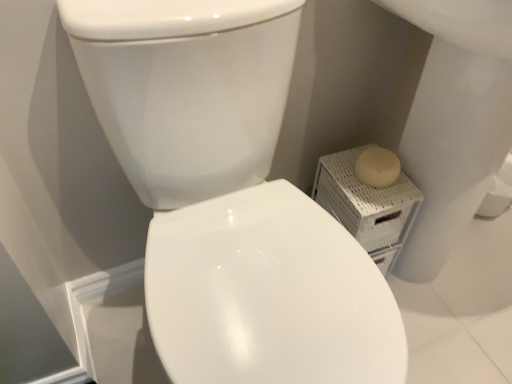
Where is `vacant area on top of beige wicker basket at right (from a real-world perspective)`? This screenshot has height=384, width=512. vacant area on top of beige wicker basket at right (from a real-world perspective) is located at coordinates (372, 182).